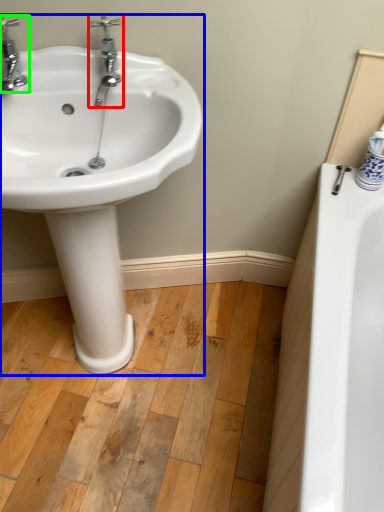
Question: Which object is the closest to the tap (highlighted by a red box)? Choose among these: sink (highlighted by a blue box) or tap (highlighted by a green box).

Choices:
 (A) sink
 (B) tap

Answer: (B)